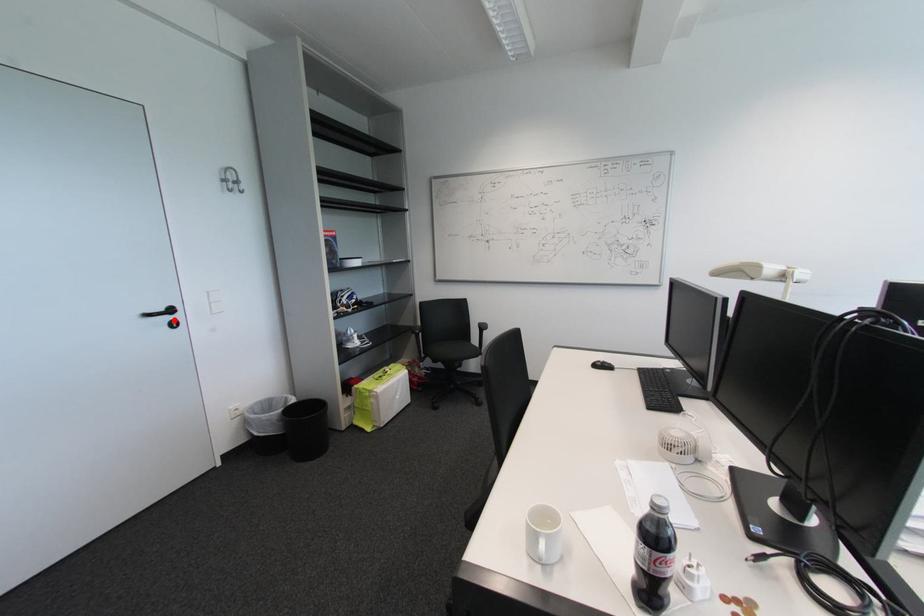
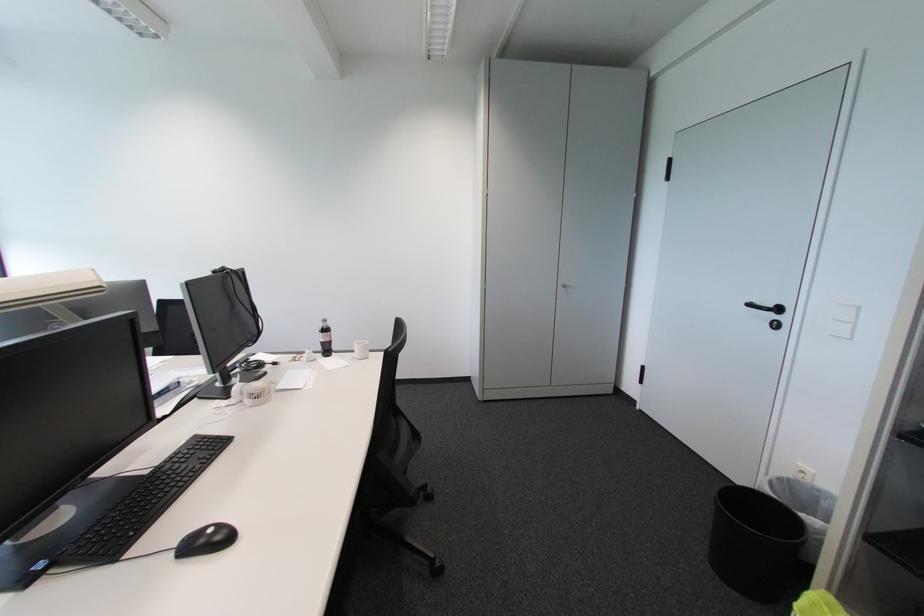
In the second image, find the point that corresponds to the highlighted location in the first image.

(777, 317)